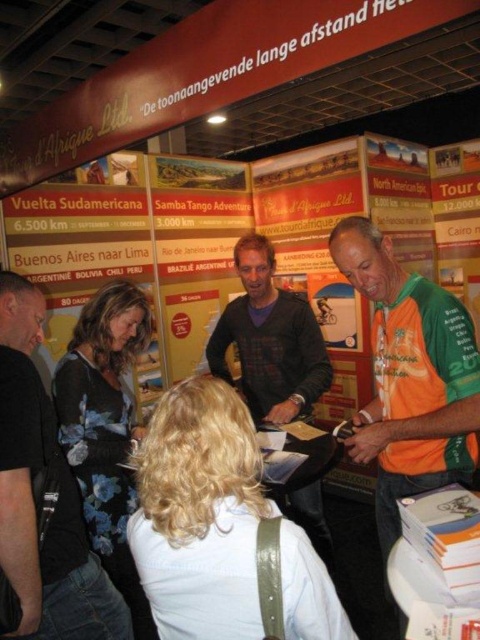
Who is higher up, orange jersey at right or dark brown sweater at center?

Positioned higher is dark brown sweater at center.

Does orange jersey at right have a smaller size compared to dark brown sweater at center?

No, orange jersey at right is not smaller than dark brown sweater at center.

Find the location of a particular element. The height and width of the screenshot is (640, 480). orange jersey at right is located at coordinates (409, 378).

Does orange jersey at right appear under black fabric shirt at left?

No, orange jersey at right is not below black fabric shirt at left.

Can you confirm if orange jersey at right is shorter than black fabric shirt at left?

No.

Locate an element on the screen. orange jersey at right is located at coordinates (409, 378).

Is black fabric shirt at left bigger than dark brown sweater at center?

Actually, black fabric shirt at left might be smaller than dark brown sweater at center.

I want to click on black fabric shirt at left, so click(33, 496).